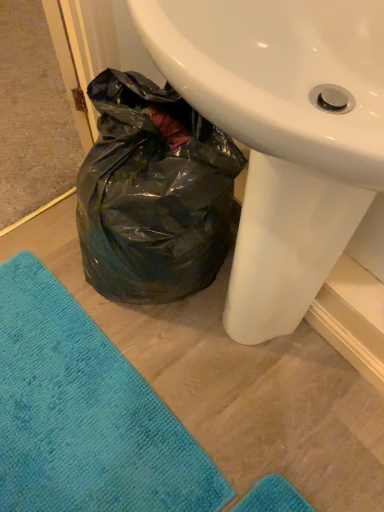
The height and width of the screenshot is (512, 384). In order to click on free spot above teal soft towel at lower left (from a real-world perspective) in this screenshot , I will do `click(64, 404)`.